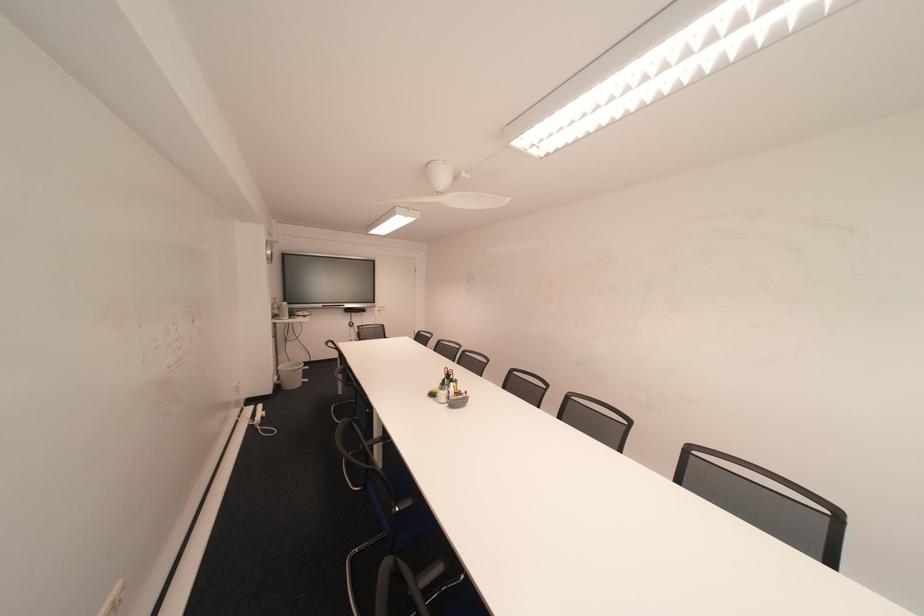
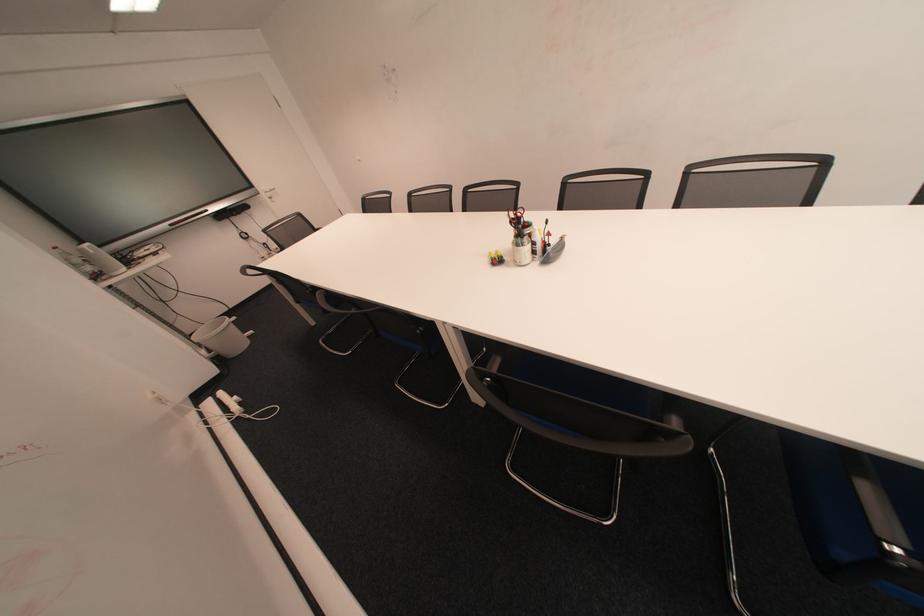
In the second image, find the point that corresponds to (288,371) in the first image.

(209, 345)